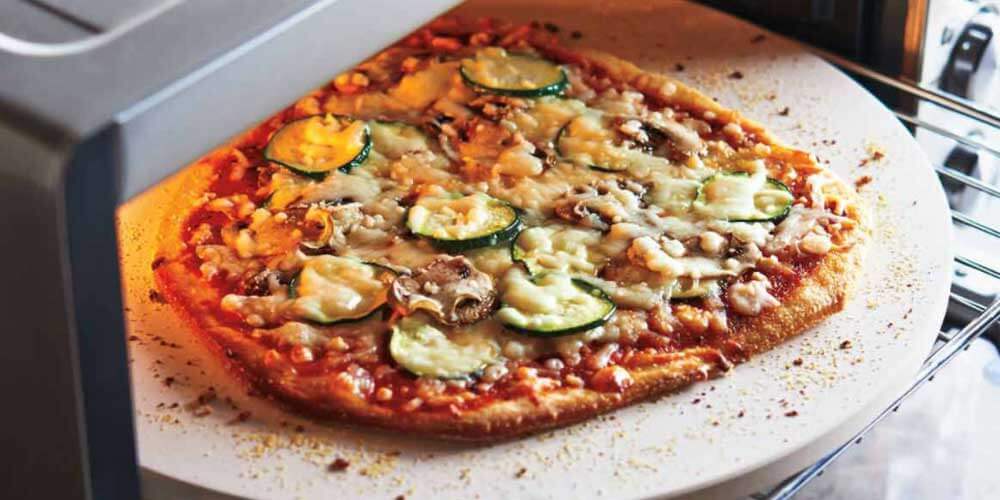
Where is `side of oven`? side of oven is located at coordinates coord(41,339).